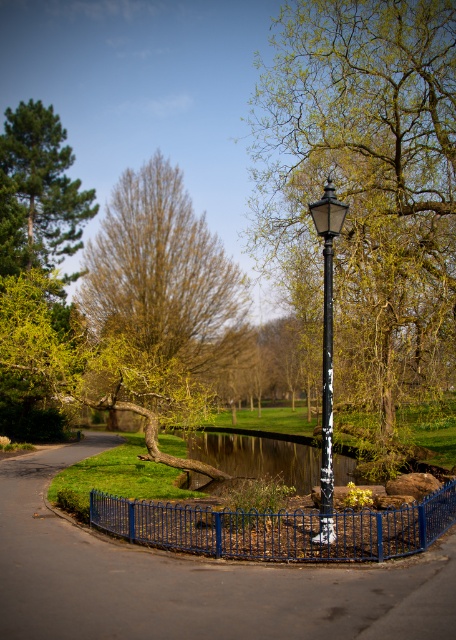
You are a visitor walking along the paved pathway in the park and notice two fences at the center. Which fence, the black metal fence at center or the blue metal fence at center, is closer to you?

The black metal fence at center is closer to you because it is in front of the blue metal fence at center.

You are a park visitor carrying a large backpack and need to pass through the area where the black metal fence at center and the metallic pole at center are located. Given that your backpack is 1.2 meters wide, can you navigate through the space between them without removing the backpack?

The black metal fence at center is bigger than the metallic pole at center, so the space between them may be too narrow for a backpack that is 1.2 meters wide. It is recommended to remove the backpack or find an alternative path to ensure safe passage.